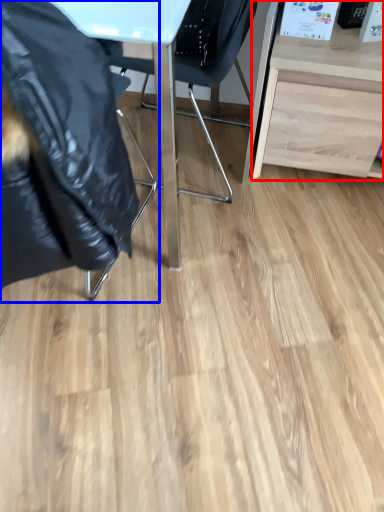
Question: Which object is closer to the camera taking this photo, desk (highlighted by a red box) or chair (highlighted by a blue box)?

Choices:
 (A) desk
 (B) chair

Answer: (B)